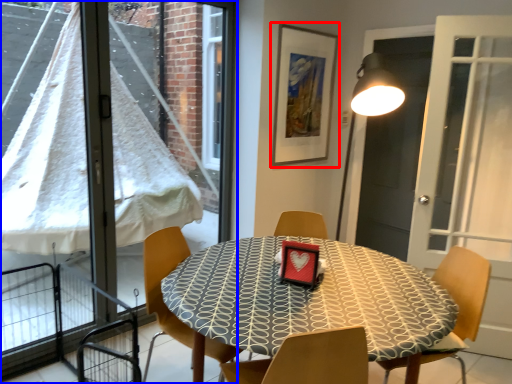
Question: Which object is closer to the camera taking this photo, picture frame (highlighted by a red box) or window (highlighted by a blue box)?

Choices:
 (A) picture frame
 (B) window

Answer: (B)